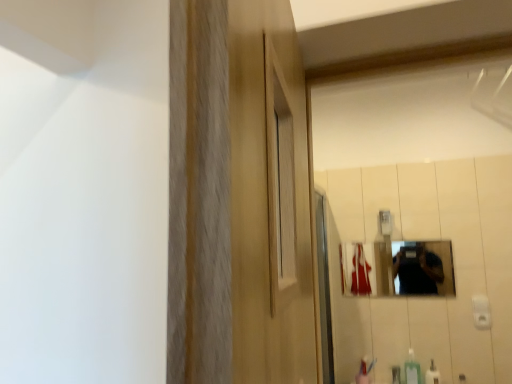
Question: Does green plastic soap dispenser at lower right appear on the right side of white glossy bottle at lower right?

Choices:
 (A) yes
 (B) no

Answer: (B)

Question: Is white glossy bottle at lower right located within green plastic soap dispenser at lower right?

Choices:
 (A) yes
 (B) no

Answer: (B)

Question: Does green plastic soap dispenser at lower right have a smaller size compared to white glossy bottle at lower right?

Choices:
 (A) no
 (B) yes

Answer: (A)

Question: Can you see green plastic soap dispenser at lower right touching white glossy bottle at lower right?

Choices:
 (A) yes
 (B) no

Answer: (A)

Question: From the image's perspective, is green plastic soap dispenser at lower right on top of white glossy bottle at lower right?

Choices:
 (A) yes
 (B) no

Answer: (A)

Question: Are green plastic soap dispenser at lower right and white glossy bottle at lower right far apart?

Choices:
 (A) no
 (B) yes

Answer: (A)

Question: Is green plastic soap dispenser at lower right oriented away from metallic reflective mirror at center?

Choices:
 (A) yes
 (B) no

Answer: (B)

Question: Does green plastic soap dispenser at lower right turn towards metallic reflective mirror at center?

Choices:
 (A) no
 (B) yes

Answer: (A)

Question: Is green plastic soap dispenser at lower right thinner than metallic reflective mirror at center?

Choices:
 (A) no
 (B) yes

Answer: (A)

Question: From the image's perspective, is green plastic soap dispenser at lower right under metallic reflective mirror at center?

Choices:
 (A) no
 (B) yes

Answer: (B)

Question: From the image's perspective, is green plastic soap dispenser at lower right above metallic reflective mirror at center?

Choices:
 (A) yes
 (B) no

Answer: (B)

Question: Does green plastic soap dispenser at lower right appear on the right side of metallic reflective mirror at center?

Choices:
 (A) no
 (B) yes

Answer: (B)

Question: Is white glossy bottle at lower right further to the viewer compared to metallic reflective mirror at center?

Choices:
 (A) yes
 (B) no

Answer: (B)